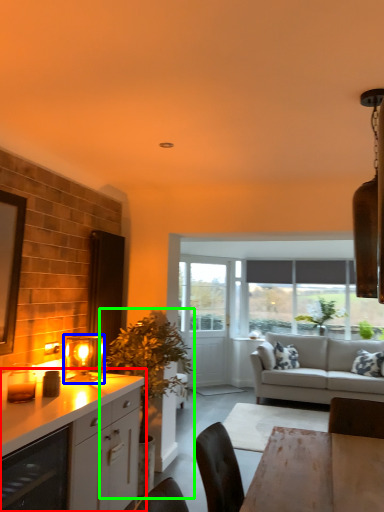
Question: Based on their relative distances, which object is nearer to cabinetry (highlighted by a red box)? Choose from light fixture (highlighted by a blue box) and houseplant (highlighted by a green box).

Choices:
 (A) light fixture
 (B) houseplant

Answer: (A)